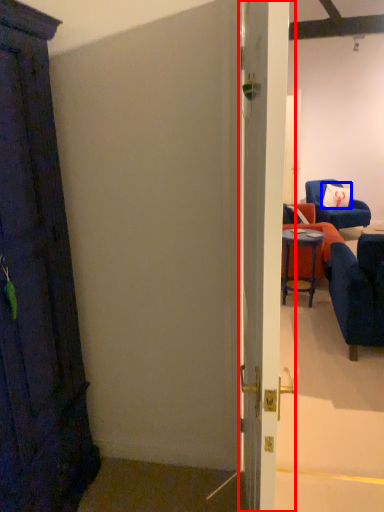
Question: Among these objects, which one is farthest to the camera, door (highlighted by a red box) or pillow (highlighted by a blue box)?

Choices:
 (A) door
 (B) pillow

Answer: (B)